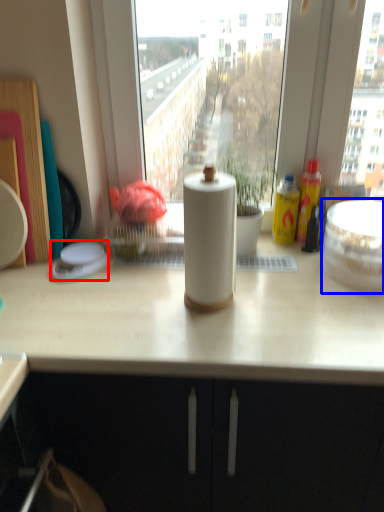
Question: Which point is further to the camera, appliance (highlighted by a red box) or appliance (highlighted by a blue box)?

Choices:
 (A) appliance
 (B) appliance

Answer: (A)